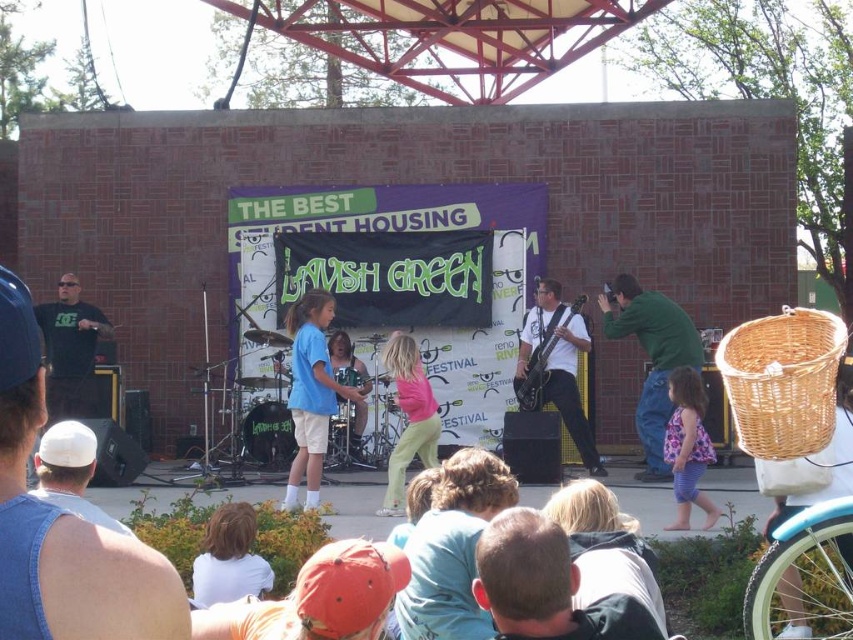
In the scene shown: You are at the music festival and notice two clothing items in the crowd. The denim vest at left and the white fabric shirt at lower left. Which clothing item is positioned higher from the ground?

The denim vest at left is positioned higher from the ground than the white fabric shirt at lower left because it is above it.

You are at the music festival and want to take a photo of the stage. You notice two points marked in the scene. The first point is at coordinates point (287, 324) and the second is at point (683, 374). Which point is closer to you, the photographer?

Point (287, 324) is closer to you because it is further to the viewer than point (683, 374).